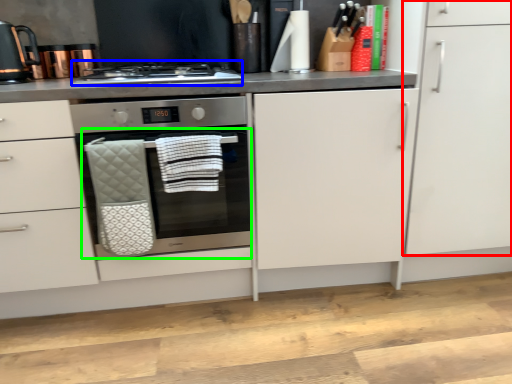
Question: Which object is positioned closest to cabinetry (highlighted by a red box)? Select from gas stove (highlighted by a blue box) and oven (highlighted by a green box).

Choices:
 (A) gas stove
 (B) oven

Answer: (B)